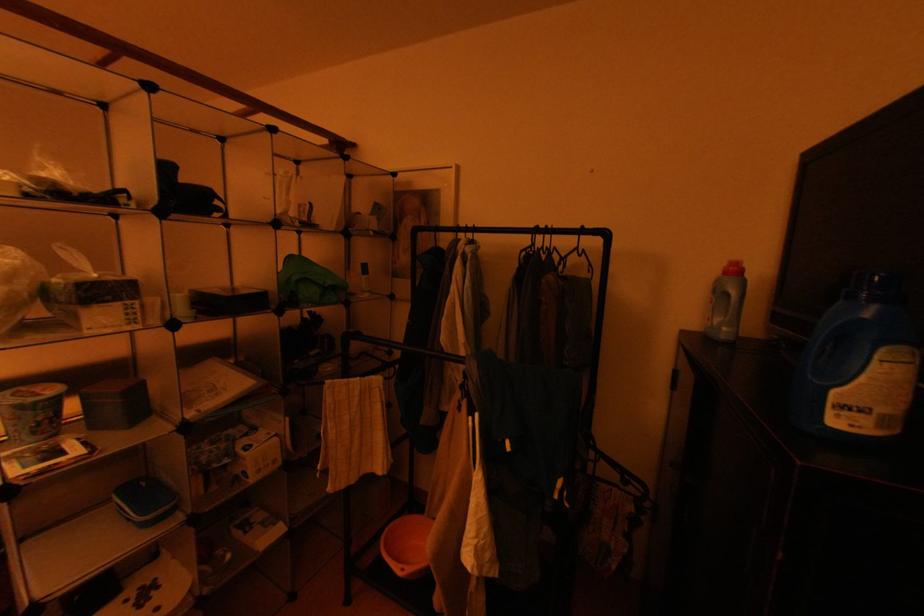
Where would you lift the blue bottle handle? Please return your answer as a coordinate pair (x, y).

(857, 365)